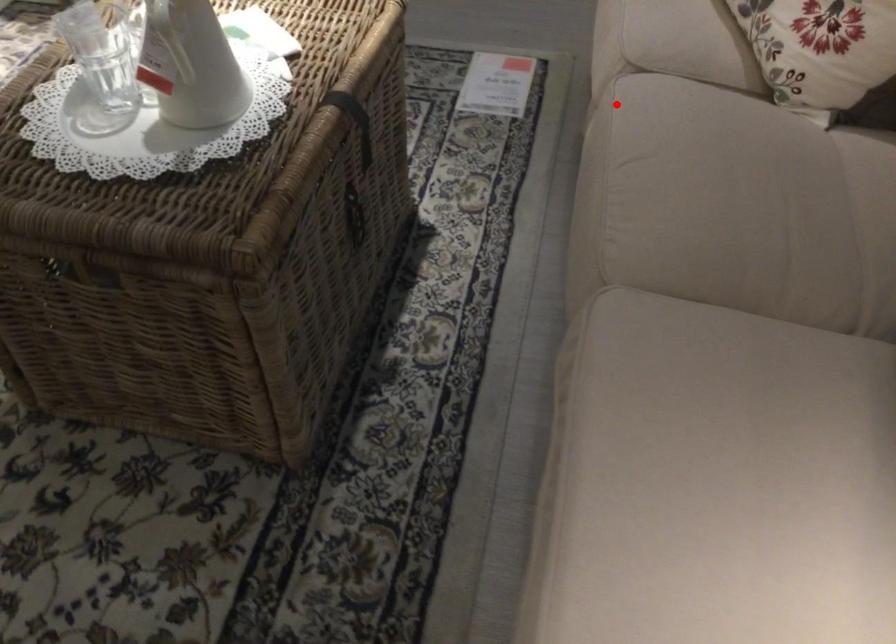
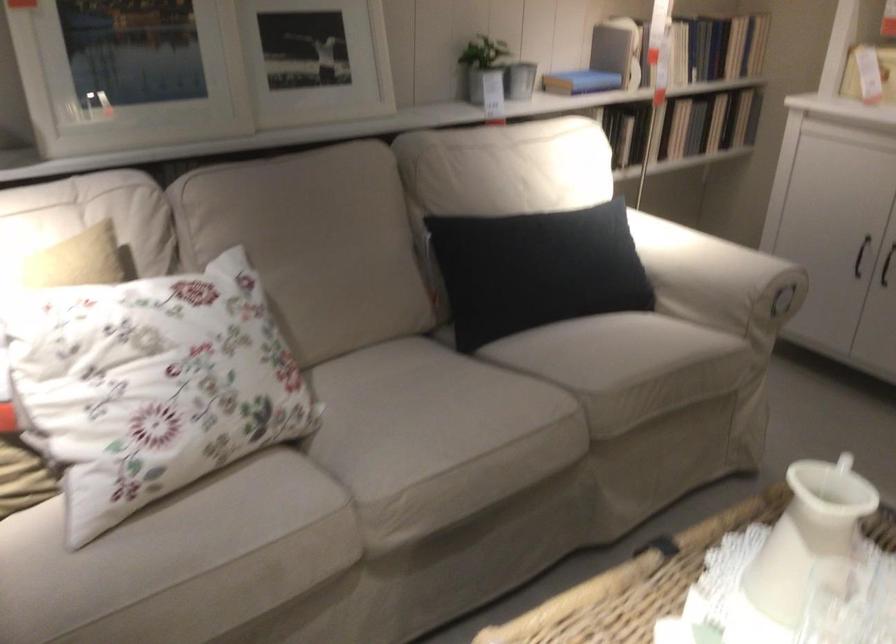
Where in the second image is the point corresponding to the highlighted location from the first image?

(398, 494)